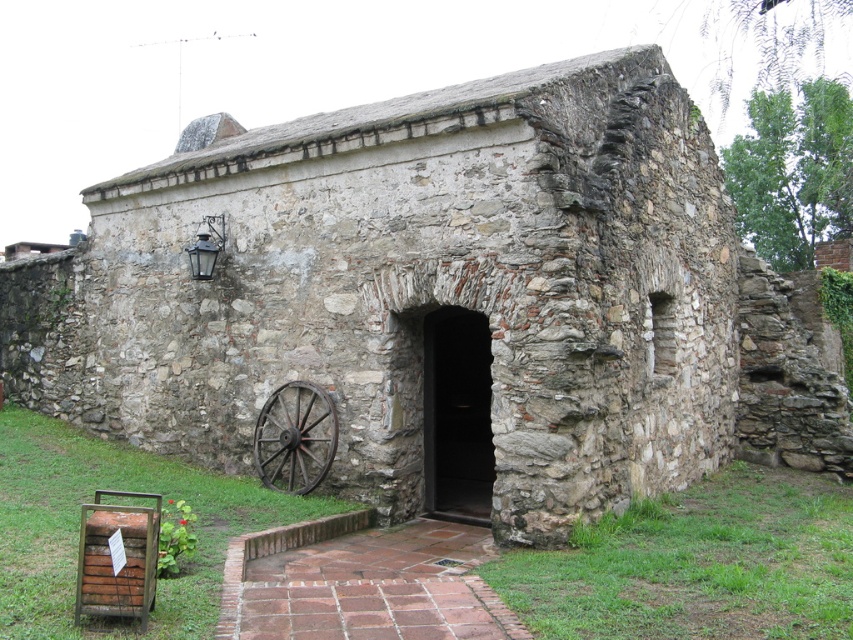
Can you confirm if rustic stone fort at center is wider than dark stone door at center?

Correct, the width of rustic stone fort at center exceeds that of dark stone door at center.

Does rustic stone fort at center have a lesser height compared to dark stone door at center?

No.

The width and height of the screenshot is (853, 640). I want to click on rustic stone fort at center, so click(415, 289).

Between point (587, 106) and point (276, 388), which one is positioned behind?

The point (276, 388) is behind.

Is rustic stone fort at center thinner than rusty metal wagon wheel at lower left?

Incorrect, rustic stone fort at center's width is not less than rusty metal wagon wheel at lower left's.

Where is `rustic stone fort at center`? This screenshot has width=853, height=640. rustic stone fort at center is located at coordinates (415, 289).

Can you confirm if dark stone door at center is positioned to the right of rusty metal wagon wheel at lower left?

Indeed, dark stone door at center is positioned on the right side of rusty metal wagon wheel at lower left.

Between point (444, 435) and point (323, 401), which one is positioned behind?

Positioned behind is point (444, 435).

Which is behind, point (428, 428) or point (254, 460)?

The point (254, 460) is more distant.

This screenshot has width=853, height=640. Find the location of `dark stone door at center`. dark stone door at center is located at coordinates (456, 413).